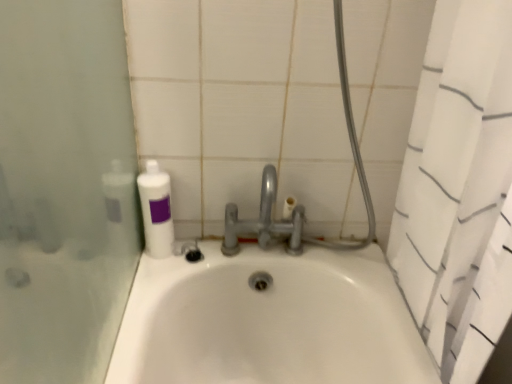
What do you see at coordinates (156, 210) in the screenshot? I see `white matte bottle at upper left` at bounding box center [156, 210].

Identify the location of white matte bottle at upper left. (156, 210).

Is white matte bottle at upper left not inside satin nickel faucet at center?

Yes, white matte bottle at upper left is located beyond the bounds of satin nickel faucet at center.

Which of these two, white matte bottle at upper left or satin nickel faucet at center, stands shorter?

white matte bottle at upper left.

From the image's perspective, would you say white matte bottle at upper left is positioned over satin nickel faucet at center?

Yes.

Can you confirm if white matte bottle at upper left is positioned to the left of satin nickel faucet at center?

Yes, white matte bottle at upper left is to the left of satin nickel faucet at center.

Considering the relative sizes of white textured shower curtain at right and white matte bottle at upper left in the image provided, is white textured shower curtain at right shorter than white matte bottle at upper left?

In fact, white textured shower curtain at right may be taller than white matte bottle at upper left.

Between white textured shower curtain at right and white matte bottle at upper left, which one has larger width?

With larger width is white textured shower curtain at right.

Relative to white matte bottle at upper left, is white textured shower curtain at right in front or behind?

In the image, white textured shower curtain at right appears in front of white matte bottle at upper left.

Considering the relative sizes of satin nickel faucet at center and white textured shower curtain at right in the image provided, is satin nickel faucet at center bigger than white textured shower curtain at right?

Actually, satin nickel faucet at center might be smaller than white textured shower curtain at right.

This screenshot has width=512, height=384. In order to click on tap behind the white textured shower curtain at right in this screenshot , I will do `click(264, 220)`.

Is satin nickel faucet at center facing away from white textured shower curtain at right?

No.

Considering the relative sizes of satin nickel faucet at center and white textured shower curtain at right in the image provided, is satin nickel faucet at center wider than white textured shower curtain at right?

In fact, satin nickel faucet at center might be narrower than white textured shower curtain at right.

Does white matte bottle at upper left have a smaller size compared to white textured shower curtain at right?

Correct, white matte bottle at upper left occupies less space than white textured shower curtain at right.

How different are the orientations of white matte bottle at upper left and white textured shower curtain at right in degrees?

83.9 degrees separate the facing orientations of white matte bottle at upper left and white textured shower curtain at right.

Is white matte bottle at upper left facing towards white textured shower curtain at right?

No, white matte bottle at upper left does not turn towards white textured shower curtain at right.

Which object is further away from the camera taking this photo, white matte bottle at upper left or white textured shower curtain at right?

white matte bottle at upper left is further away from the camera.

Which is more to the left, white textured shower curtain at right or satin nickel faucet at center?

satin nickel faucet at center.

Is white textured shower curtain at right not within satin nickel faucet at center?

white textured shower curtain at right lies outside satin nickel faucet at center's area.

Is white textured shower curtain at right oriented away from satin nickel faucet at center?

That's right, white textured shower curtain at right is facing away from satin nickel faucet at center.

You are a GUI agent. You are given a task and a screenshot of the screen. Output one action in this format:
    pyautogui.click(x=<x>, y=<y>)
    Task: Click on the tap located above the white textured shower curtain at right (from the image's perspective)
    
    Given the screenshot: What is the action you would take?
    pyautogui.click(x=264, y=220)

Is satin nickel faucet at center taller or shorter than white matte bottle at upper left?

satin nickel faucet at center is taller than white matte bottle at upper left.

You are a GUI agent. You are given a task and a screenshot of the screen. Output one action in this format:
    pyautogui.click(x=<x>, y=<y>)
    Task: Click on the tap on the right of white matte bottle at upper left
    
    Given the screenshot: What is the action you would take?
    pyautogui.click(x=264, y=220)

Which object is further away from the camera, satin nickel faucet at center or white matte bottle at upper left?

white matte bottle at upper left.

Does satin nickel faucet at center touch white matte bottle at upper left?

No, satin nickel faucet at center is not next to white matte bottle at upper left.

The height and width of the screenshot is (384, 512). In order to click on cleaning product located underneath the satin nickel faucet at center (from a real-world perspective) in this screenshot , I will do `click(156, 210)`.

Where is `cleaning product above the white textured shower curtain at right (from the image's perspective)`? cleaning product above the white textured shower curtain at right (from the image's perspective) is located at coordinates coord(156,210).

From the image, which object appears to be nearer to white matte bottle at upper left, white textured shower curtain at right or satin nickel faucet at center?

satin nickel faucet at center.

When comparing their distances from white textured shower curtain at right, does white matte bottle at upper left or satin nickel faucet at center seem further?

Based on the image, white matte bottle at upper left appears to be further to white textured shower curtain at right.

Which object lies nearer to the anchor point satin nickel faucet at center, white matte bottle at upper left or white textured shower curtain at right?

Among the two, white matte bottle at upper left is located nearer to satin nickel faucet at center.

Looking at the image, which one is located further to satin nickel faucet at center, white textured shower curtain at right or white matte bottle at upper left?

The object further to satin nickel faucet at center is white textured shower curtain at right.

Based on their spatial positions, is satin nickel faucet at center or white textured shower curtain at right further from white matte bottle at upper left?

white textured shower curtain at right.

When comparing their distances from white textured shower curtain at right, does satin nickel faucet at center or white matte bottle at upper left seem further?

Based on the image, white matte bottle at upper left appears to be further to white textured shower curtain at right.

Find the location of `tap between white matte bottle at upper left and white textured shower curtain at right from left to right`. tap between white matte bottle at upper left and white textured shower curtain at right from left to right is located at coordinates 264,220.